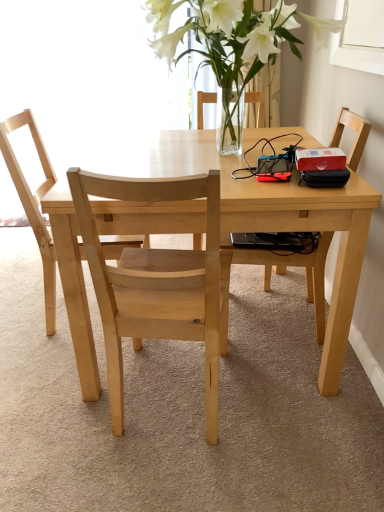
Image resolution: width=384 pixels, height=512 pixels. I want to click on vacant space to the right of natural wood chair at center, which appears as the 2th chair when viewed from the right, so click(x=301, y=431).